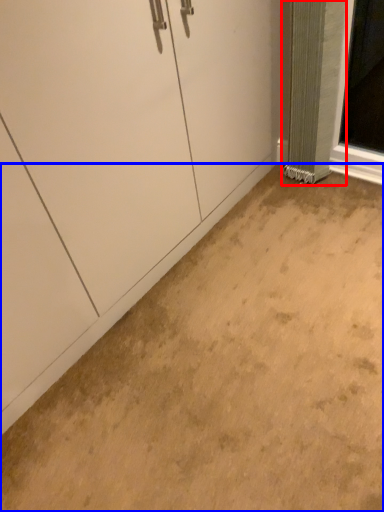
Question: Which object appears farthest to the camera in this image, curtain (highlighted by a red box) or concrete (highlighted by a blue box)?

Choices:
 (A) curtain
 (B) concrete

Answer: (A)